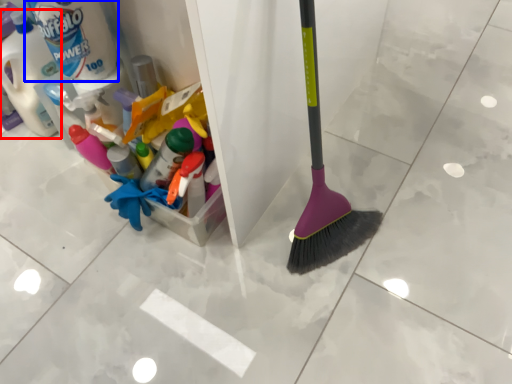
Question: Which object appears farthest to the camera in this image, bottle (highlighted by a red box) or cleaning product (highlighted by a blue box)?

Choices:
 (A) bottle
 (B) cleaning product

Answer: (A)